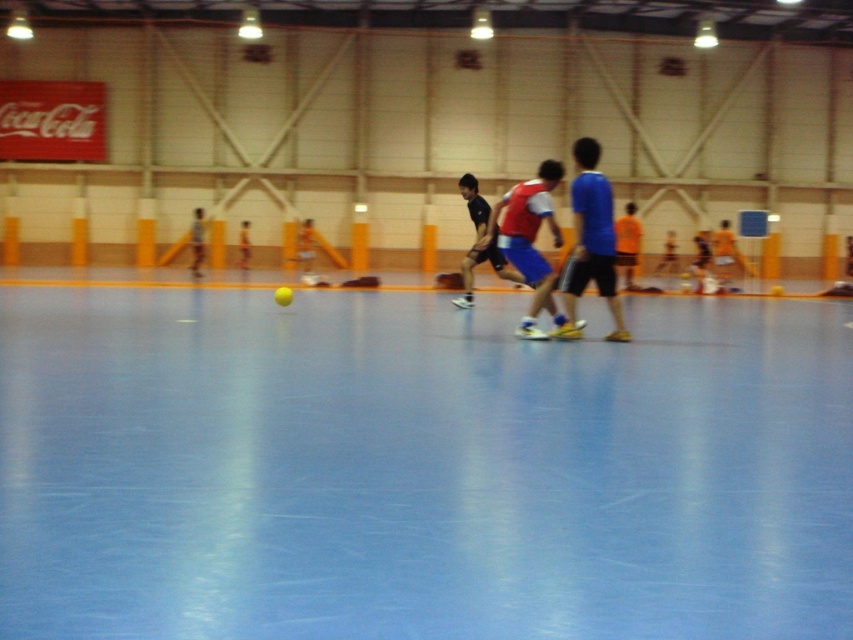
You are a sports analyst observing the handball game. You notice two key players wearing the blue matte shorts at center and the matte red jersey at center. Based on their clothing, which player has a wider lower body garment?

The blue matte shorts at center has a larger width than the matte red jersey at center, so the player wearing the blue matte shorts at center has a wider lower body garment.

What are the coordinates of the blue matte shorts at center?

The blue matte shorts at center is located at point (590,241).